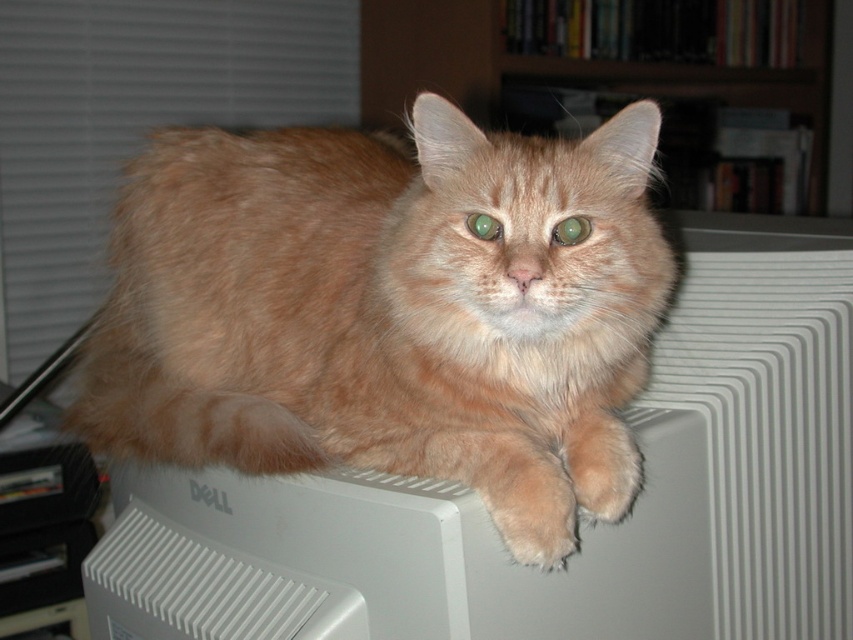
Question: Which object is closer to the camera taking this photo?

Choices:
 (A) fuzzy orange cat at center
 (B) wooden bookshelf at upper center

Answer: (A)

Question: Is fuzzy orange cat at center below wooden bookshelf at upper center?

Choices:
 (A) no
 (B) yes

Answer: (B)

Question: From the image, what is the correct spatial relationship of fuzzy orange cat at center in relation to wooden bookshelf at upper center?

Choices:
 (A) above
 (B) below

Answer: (B)

Question: Observing the image, what is the correct spatial positioning of fuzzy orange cat at center in reference to wooden bookshelf at upper center?

Choices:
 (A) above
 (B) below

Answer: (B)